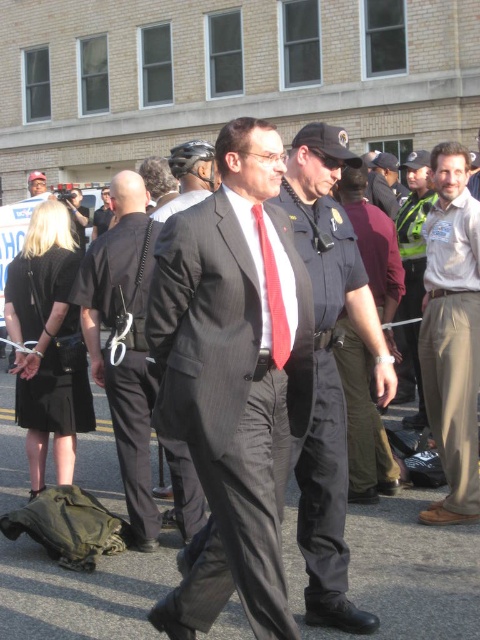
Question: Which point appears closest to the camera in this image?

Choices:
 (A) (463, 336)
 (B) (408, 268)
 (C) (213, 182)

Answer: (A)

Question: Which object is the farthest from the green reflective vest at center?

Choices:
 (A) matte black suit at center
 (B) black pinstripe suit at center

Answer: (A)

Question: Which is nearer to the green reflective vest at center?

Choices:
 (A) red satin tie at center
 (B) dark gray uniform at center

Answer: (B)

Question: Does matte black uniform at center have a smaller size compared to black pinstripe suit at center?

Choices:
 (A) no
 (B) yes

Answer: (A)

Question: Can you confirm if matte black suit at center is bigger than green reflective vest at center?

Choices:
 (A) no
 (B) yes

Answer: (A)

Question: Where is black pinstripe suit at center located in relation to dark gray uniform at center in the image?

Choices:
 (A) above
 (B) below

Answer: (B)